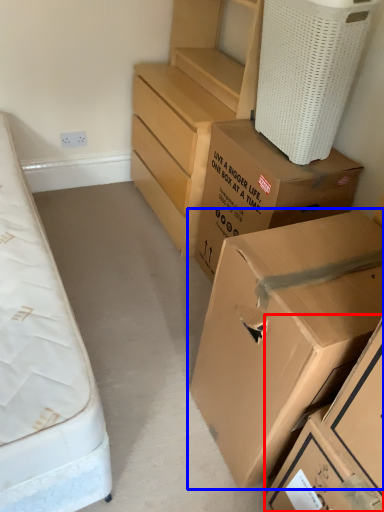
Question: Which point is closer to the camera, box (highlighted by a red box) or box (highlighted by a blue box)?

Choices:
 (A) box
 (B) box

Answer: (B)